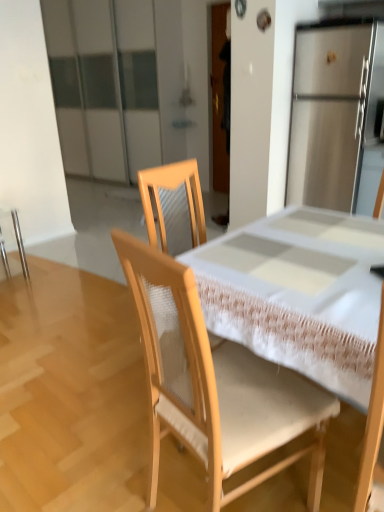
This screenshot has height=512, width=384. I want to click on vacant space in between metallic silver chair at left, the first chair positioned from the back, and wooden chair at center, positioned as the 2th chair in left-to-right order, so click(x=76, y=349).